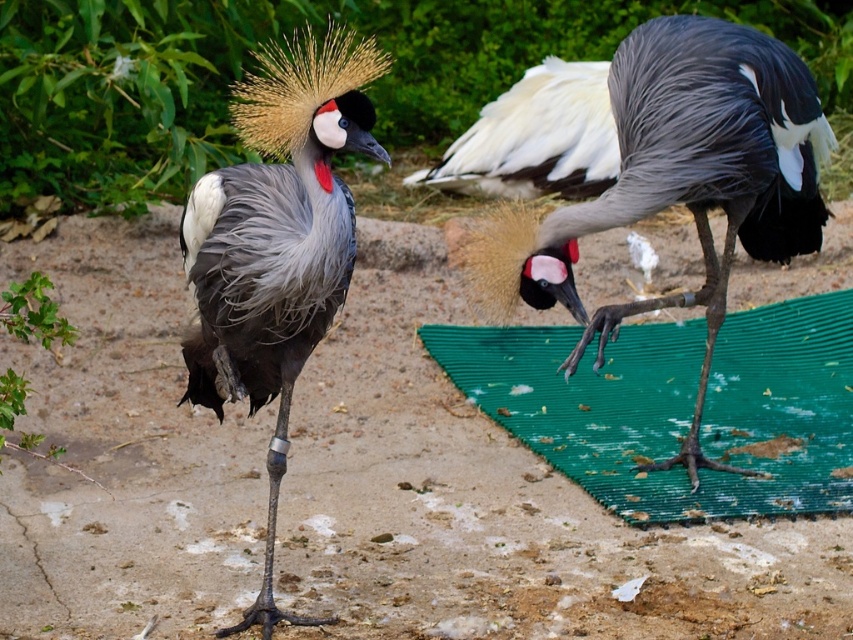
Consider the image. You are a small toy that is 10 cm wide. You want to move from the green rubber mat at lower right to the white glossy feathers at center. Can you fit through the space between them?

The green rubber mat at lower right is wider than the white glossy feathers at center. Since the space between them may be narrower than the mat, it is uncertain if the toy can fit through. Check the actual distance before moving.